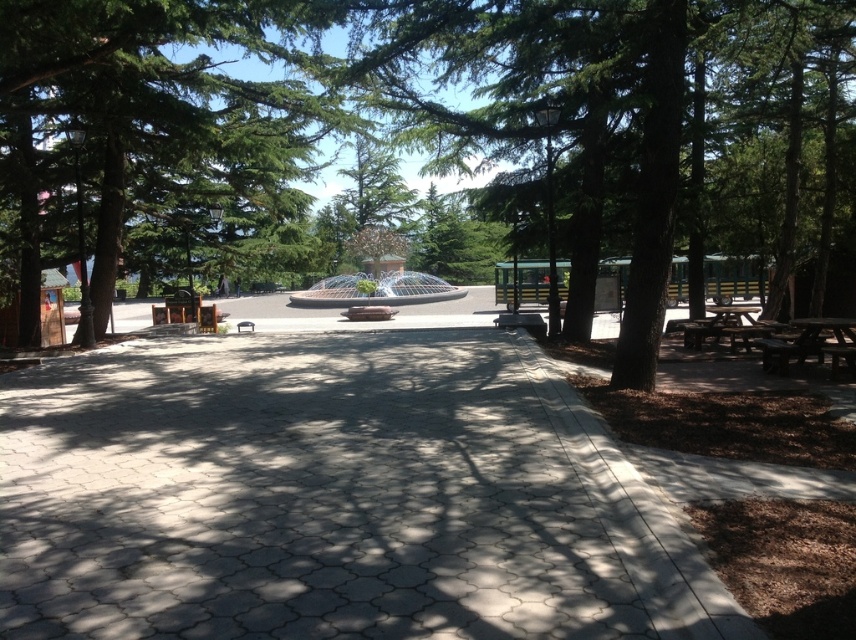
Which is behind, point (423, 509) or point (262, 29)?

Positioned behind is point (262, 29).

This screenshot has height=640, width=856. I want to click on gray concrete pavement at center, so click(331, 499).

Describe the element at coordinates (331, 499) in the screenshot. I see `gray concrete pavement at center` at that location.

Locate an element on the screen. The image size is (856, 640). gray concrete pavement at center is located at coordinates (331, 499).

Between gray concrete pavement at center and green textured tree at center, which one has more height?

→ green textured tree at center is taller.

Who is more distant from viewer, (43,556) or (629,246)?

The point (629,246) is more distant.

Between point (617, 500) and point (16, 164), which one is positioned behind?

The point (16, 164) is more distant.

At what (x,y) coordinates should I click in order to perform the action: click on gray concrete pavement at center. Please return your answer as a coordinate pair (x, y). This screenshot has height=640, width=856. Looking at the image, I should click on (331, 499).

Who is lower down, green leafy tree at center or brown wooden picnic table at lower right?

Positioned lower is brown wooden picnic table at lower right.

Is point (278, 157) in front of point (827, 344)?

No, (278, 157) is further to viewer.

You are a GUI agent. You are given a task and a screenshot of the screen. Output one action in this format:
    pyautogui.click(x=<x>, y=<y>)
    Task: Click on the green leafy tree at center
    The height and width of the screenshot is (640, 856).
    Given the screenshot: What is the action you would take?
    pyautogui.click(x=165, y=131)